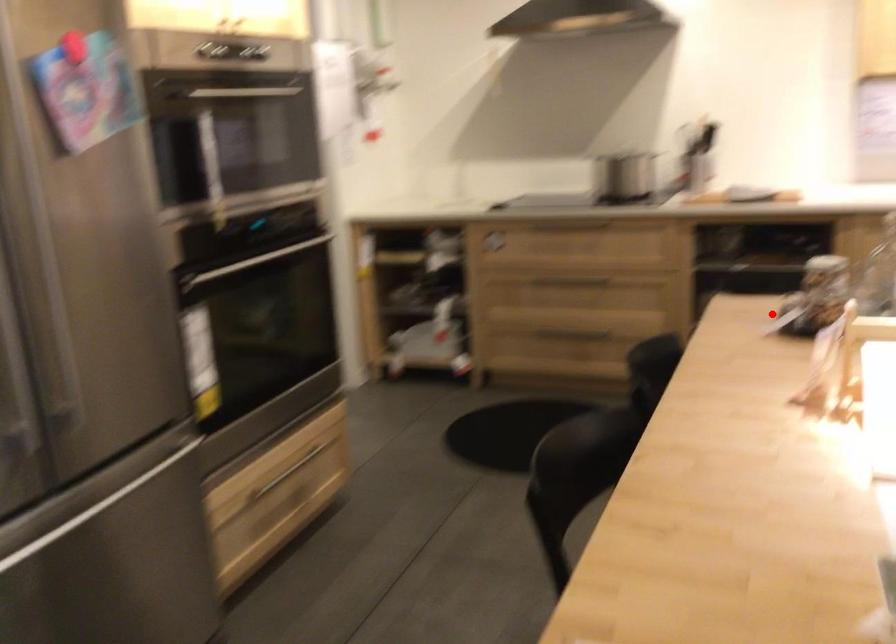
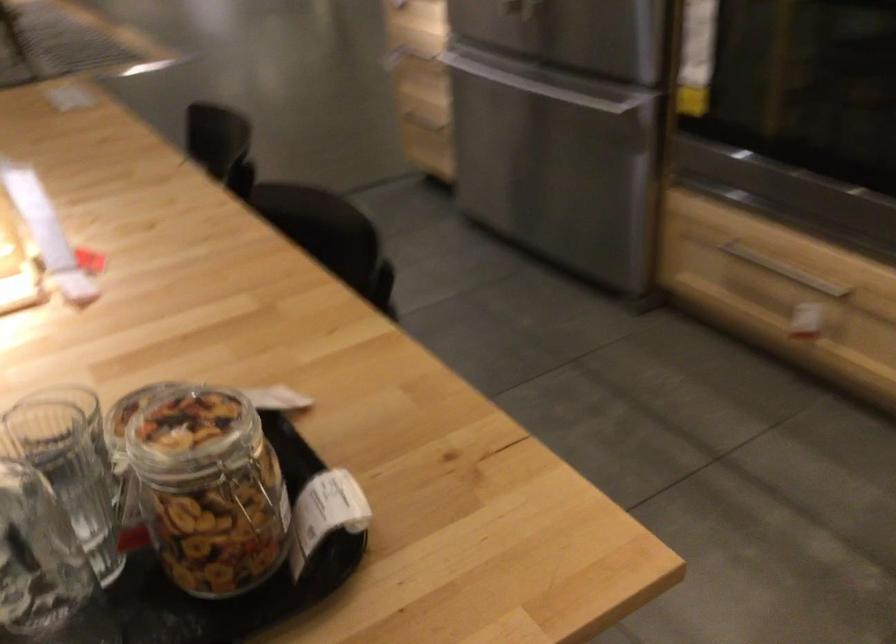
Question: I am providing you with two images of the same scene from different viewpoints. Image1 has a red point marked. In image2, the corresponding 3D location appears at what relative position? Reply with the corresponding letter.

Choices:
 (A) Closer
 (B) Farther

Answer: (A)